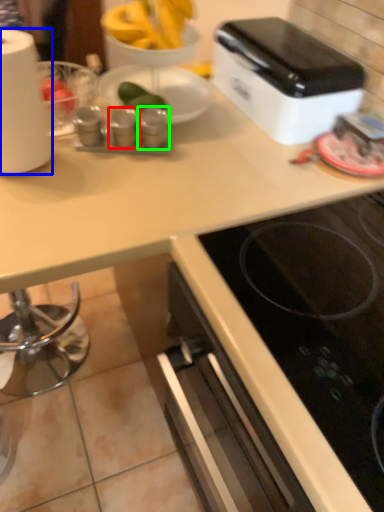
Question: Considering the real-world distances, which object is farthest from appliance (highlighted by a red box)? paper towel (highlighted by a blue box) or appliance (highlighted by a green box)?

Choices:
 (A) paper towel
 (B) appliance

Answer: (A)